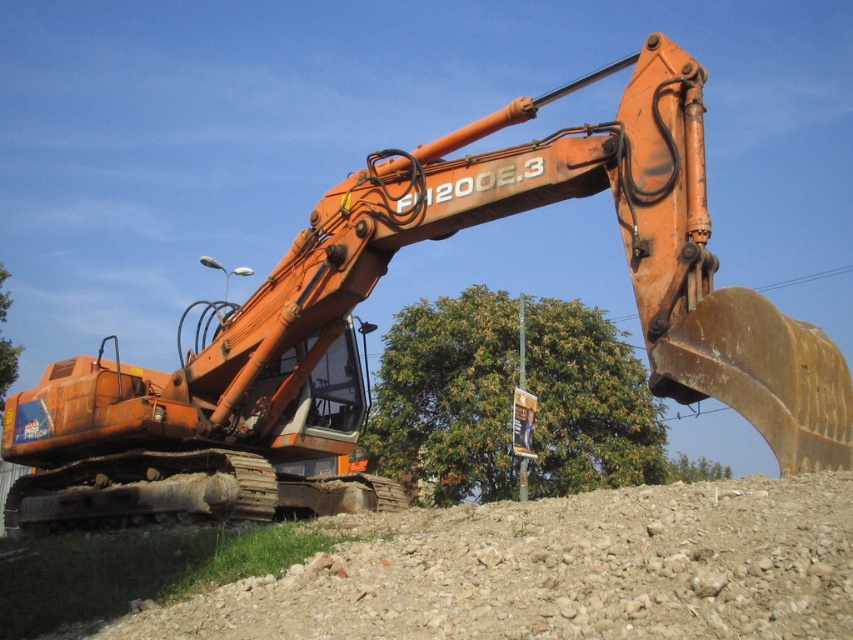
You are an environmental inspector assessing a construction site. You notice two green leafy trees on the site. The first is labeled as the green leafy tree at center, and the second is the green leafy tree at lower center. Based on their sizes, which tree might require more space in terms of horizontal spread to avoid obstruction with nearby structures? Please refer to the trees mentioned in the scene description.

The green leafy tree at lower center requires more space in terms of horizontal spread because it has a greater width than the green leafy tree at center.